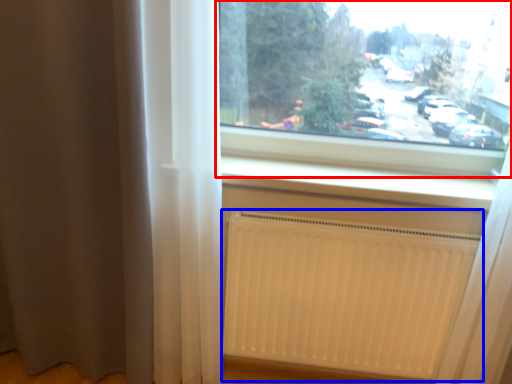
Question: Which of the following is the closest to the observer, window (highlighted by a red box) or radiator (highlighted by a blue box)?

Choices:
 (A) window
 (B) radiator

Answer: (A)